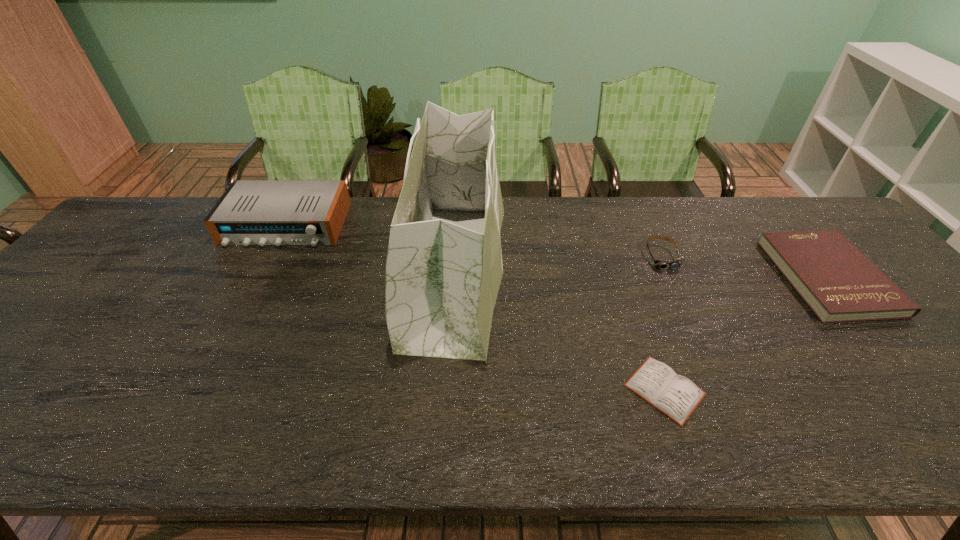
Where is `vacant position at the near edge of the desktop`? vacant position at the near edge of the desktop is located at coordinates (79, 428).

Locate an element on the screen. vacant region at the left edge of the desktop is located at coordinates (125, 272).

Identify the location of free space at the right edge. This screenshot has width=960, height=540. (914, 340).

The height and width of the screenshot is (540, 960). I want to click on free space at the far left corner of the desktop, so click(136, 235).

Find the location of a particular element. The height and width of the screenshot is (540, 960). free point between the leftmost object and the fourth object from right to left is located at coordinates (372, 248).

Identify the location of unoccupied position between the shortest object and the tallest object. The height and width of the screenshot is (540, 960). (561, 331).

Find the location of `blank region between the goggles and the hardback book`. blank region between the goggles and the hardback book is located at coordinates (745, 266).

You are a GUI agent. You are given a task and a screenshot of the screen. Output one action in this format:
    pyautogui.click(x=<x>, y=<y>)
    Task: Click on the empty location between the fourth object from right to left and the goggles
    This screenshot has height=540, width=960.
    Given the screenshot: What is the action you would take?
    pyautogui.click(x=559, y=264)

The image size is (960, 540). Find the location of `vacant area that lies between the tallest object and the second tallest object`. vacant area that lies between the tallest object and the second tallest object is located at coordinates (372, 248).

This screenshot has height=540, width=960. In order to click on empty location between the radio receiver and the hardback book in this screenshot , I will do `click(557, 251)`.